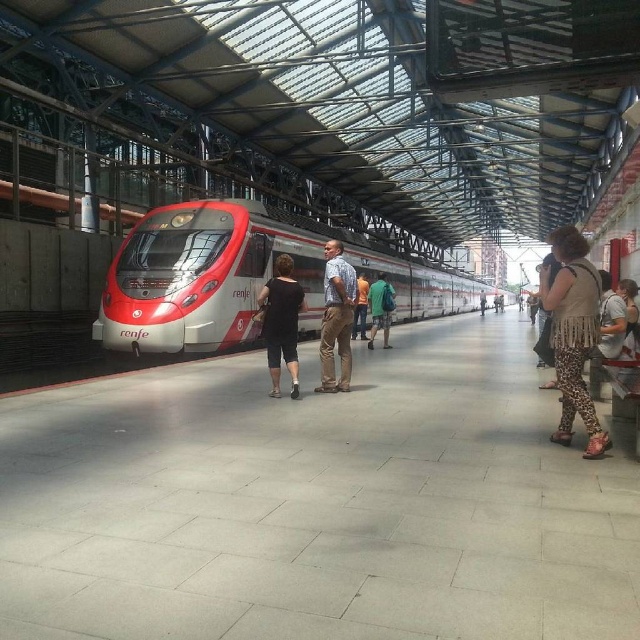
Does silver metallic train at center have a lesser width compared to green fabric backpack at center?

No, silver metallic train at center is not thinner than green fabric backpack at center.

Which is more to the right, silver metallic train at center or green fabric backpack at center?

Positioned to the right is silver metallic train at center.

Who is more forward, (x=234, y=216) or (x=381, y=344)?

Point (x=234, y=216) is in front.

What are the coordinates of `silver metallic train at center` in the screenshot? It's located at (204, 275).

What are the coordinates of `light brown cotton pants at center` in the screenshot? It's located at (337, 317).

You are a GUI agent. You are given a task and a screenshot of the screen. Output one action in this format:
    pyautogui.click(x=<x>, y=<y>)
    Task: Click on the light brown cotton pants at center
    Image resolution: width=640 pixels, height=640 pixels.
    Given the screenshot: What is the action you would take?
    pyautogui.click(x=337, y=317)

Is leopard print pants at right to the right of black matte shirt at center from the viewer's perspective?

Indeed, leopard print pants at right is positioned on the right side of black matte shirt at center.

Does leopard print pants at right appear over black matte shirt at center?

Incorrect, leopard print pants at right is not positioned above black matte shirt at center.

I want to click on leopard print pants at right, so click(x=573, y=333).

Find the location of `leopard print pants at right`. leopard print pants at right is located at coordinates (573, 333).